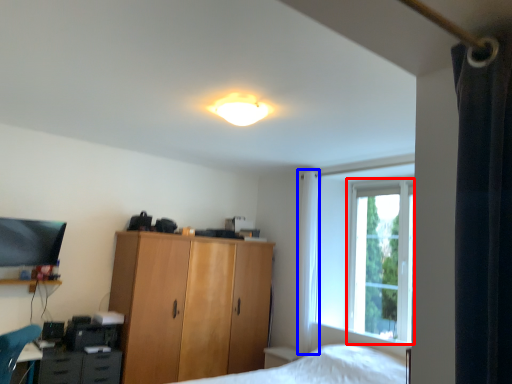
Question: Among these objects, which one is nearest to the camera, window screen (highlighted by a red box) or curtain (highlighted by a blue box)?

Choices:
 (A) window screen
 (B) curtain

Answer: (A)